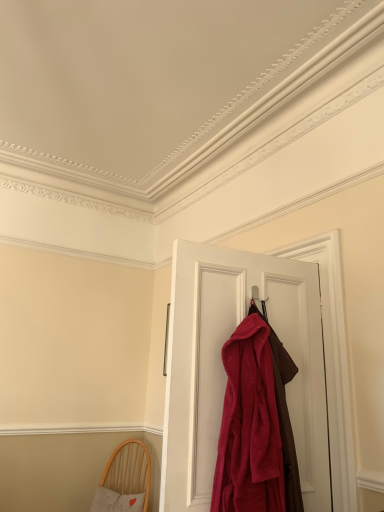
Question: Considering their positions, is light wood chair with cushion at lower left located in front of or behind velvet red robe at center?

Choices:
 (A) behind
 (B) front

Answer: (A)

Question: Is light wood chair with cushion at lower left inside the boundaries of velvet red robe at center, or outside?

Choices:
 (A) inside
 (B) outside

Answer: (B)

Question: Which object is the closest to the light wood chair with cushion at lower left?

Choices:
 (A) velvety red robe at center
 (B) velvet red robe at center

Answer: (B)

Question: Estimate the real-world distances between objects in this image. Which object is farther from the velvet red robe at center?

Choices:
 (A) velvety red robe at center
 (B) light wood chair with cushion at lower left

Answer: (B)